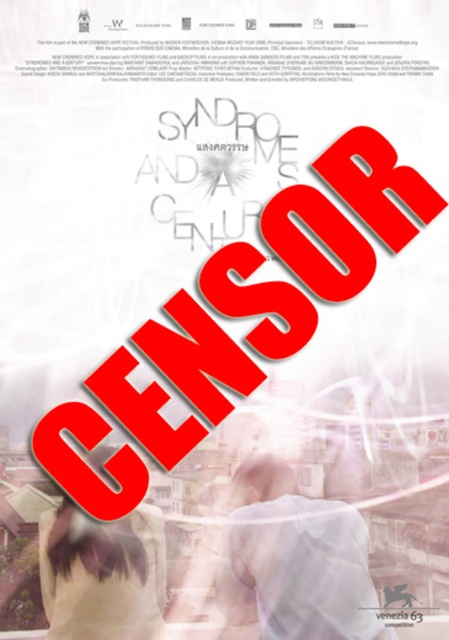
Between white matte shirt at center and light beige fabric at lower left, which one has less height?

white matte shirt at center

Does white matte shirt at center appear over light beige fabric at lower left?

Actually, white matte shirt at center is below light beige fabric at lower left.

The height and width of the screenshot is (640, 449). In order to click on white matte shirt at center in this screenshot , I will do [x=293, y=563].

Locate an element on the screen. Image resolution: width=449 pixels, height=640 pixels. white matte shirt at center is located at coordinates (293, 563).